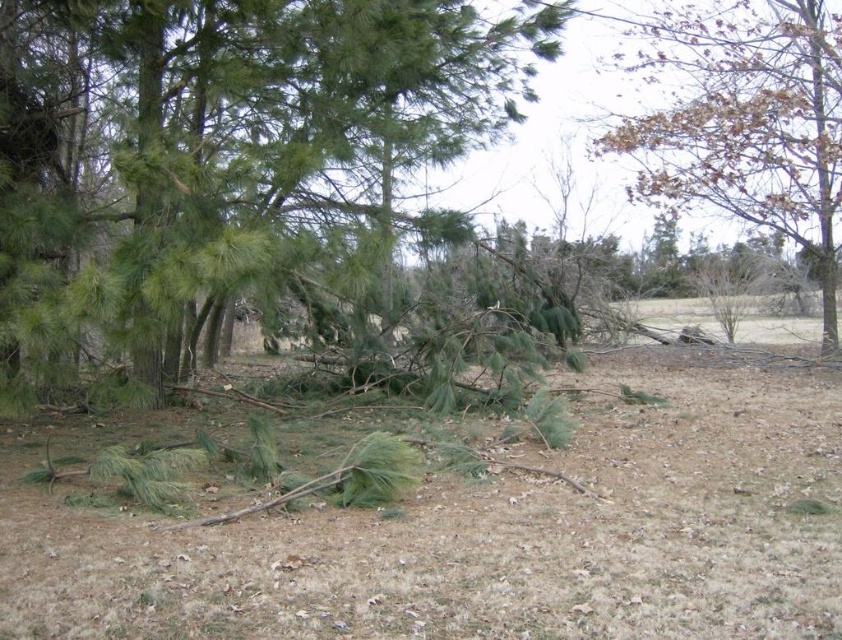
What is the color and type of the object located at point [228,150] in the image?

The object at point [228,150] is green and has needle leaves, which are characteristic of coniferous trees.